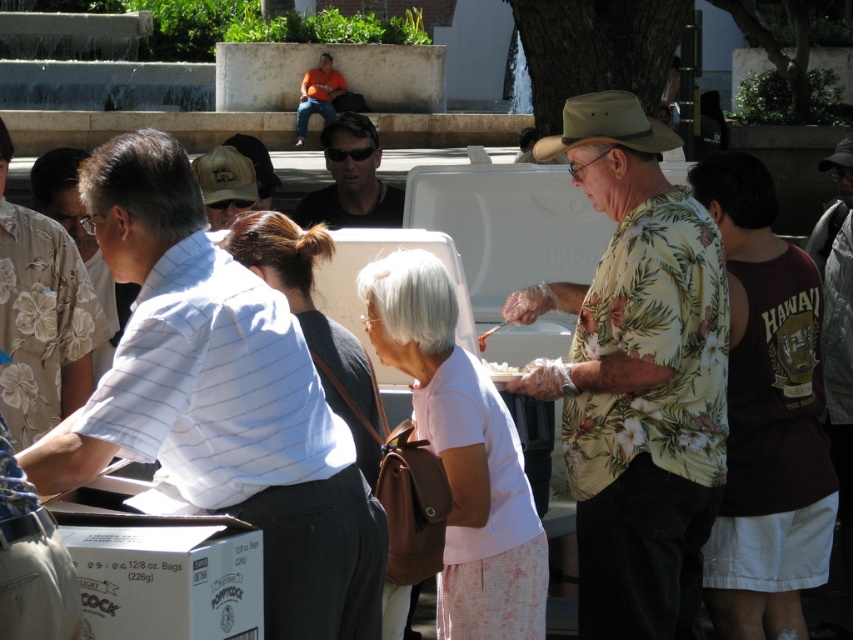
Does white striped shirt at center have a lesser width compared to white matte plate at center?

No.

Is point (190, 324) closer to camera compared to point (488, 365)?

Yes, it is.

You are a GUI agent. You are given a task and a screenshot of the screen. Output one action in this format:
    pyautogui.click(x=<x>, y=<y>)
    Task: Click on the white striped shirt at center
    This screenshot has height=640, width=853.
    Given the screenshot: What is the action you would take?
    pyautogui.click(x=219, y=397)

Which is above, maroon fabric shirt at right or orange t-shirt at upper center?

orange t-shirt at upper center

Can you confirm if maroon fabric shirt at right is shorter than orange t-shirt at upper center?

In fact, maroon fabric shirt at right may be taller than orange t-shirt at upper center.

Who is more forward, (721, 634) or (320, 88)?

Point (721, 634) is in front.

Where is `maroon fabric shirt at right`? maroon fabric shirt at right is located at coordinates click(766, 416).

Can you confirm if white fabric at center is thinner than light pink fabric shirt at center?

No, white fabric at center is not thinner than light pink fabric shirt at center.

Between point (526, 628) and point (236, 259), which one is positioned in front?

Point (236, 259) is more forward.

Is point (439, 579) closer to viewer compared to point (288, 275)?

No, (439, 579) is further to viewer.

Locate an element on the screen. The image size is (853, 640). white fabric at center is located at coordinates (461, 452).